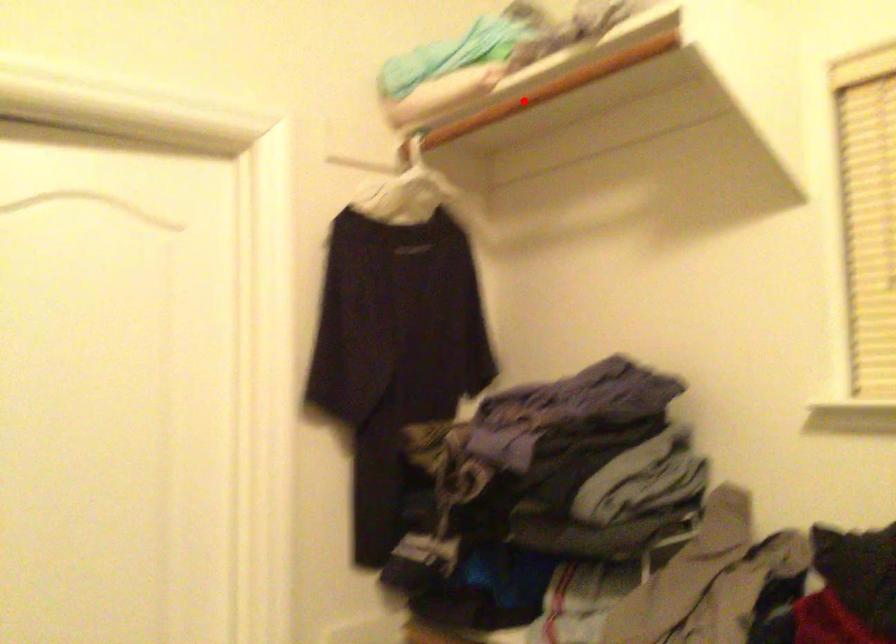
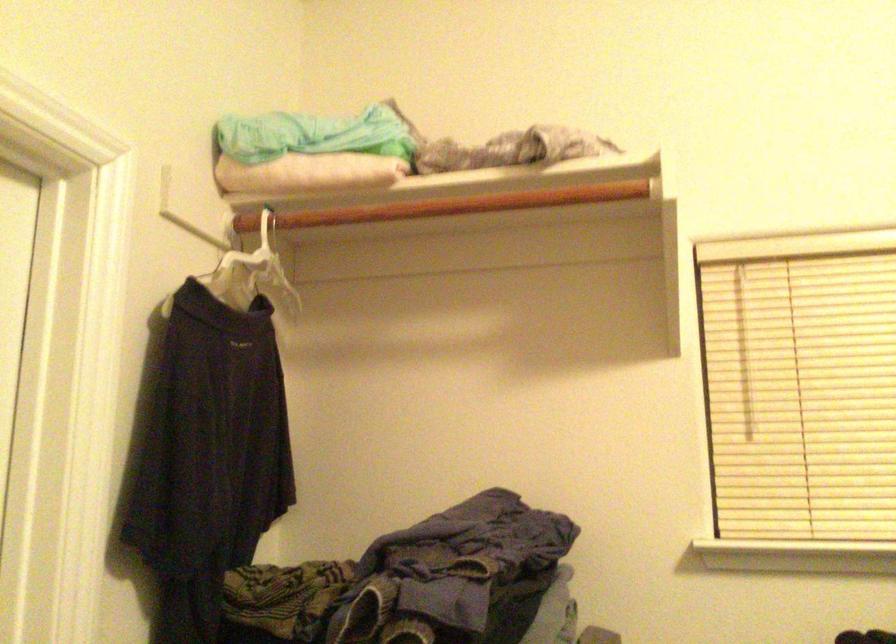
In the second image, find the point that corresponds to the highlighted location in the first image.

(452, 205)